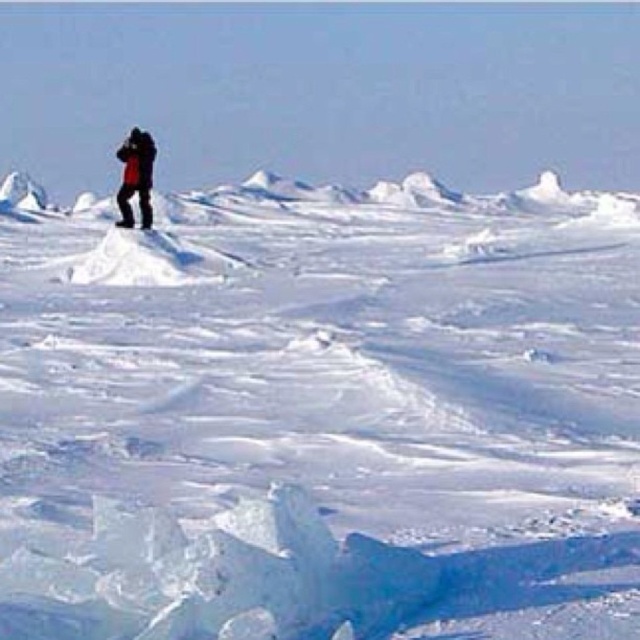
Between white frosty snow at center and red jacket at upper left, which one has less height?

red jacket at upper left is shorter.

Which is behind, point (108, 259) or point (125, 148)?

Positioned behind is point (125, 148).

Measure the distance between white frosty snow at center and camera.

white frosty snow at center and camera are 6.18 meters apart.

I want to click on white frosty snow at center, so click(321, 413).